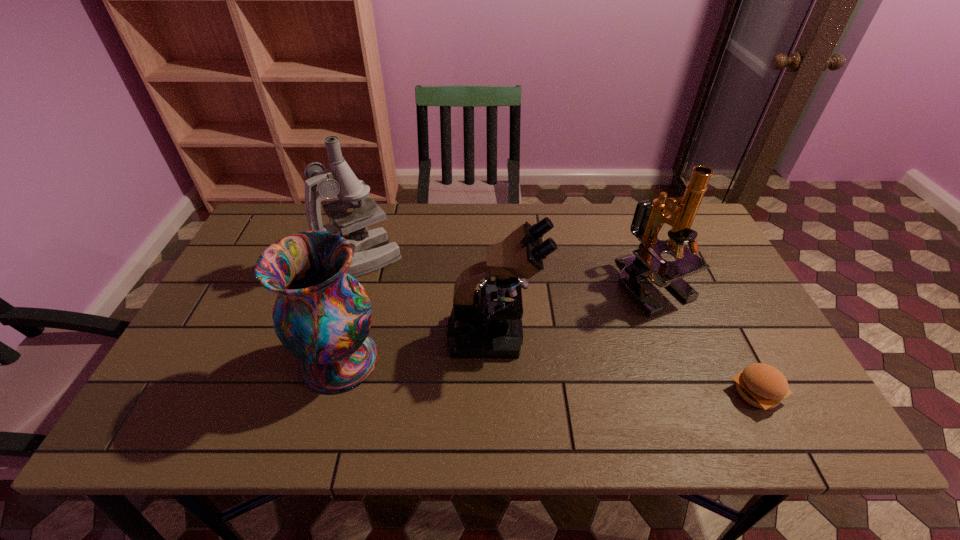
Locate an element on the screen. The width and height of the screenshot is (960, 540). object at the far edge is located at coordinates (371, 250).

In order to click on object that is positioned at the near edge in this screenshot , I will do `click(761, 385)`.

The image size is (960, 540). In order to click on microscope present at the right edge in this screenshot , I will do [x=649, y=217].

Locate an element on the screen. This screenshot has width=960, height=540. hamburger present at the right edge is located at coordinates (761, 385).

At what (x,y) coordinates should I click in order to perform the action: click on object that is at the near right corner. Please return your answer as a coordinate pair (x, y). Looking at the image, I should click on (761, 385).

Find the location of a particular element. Image resolution: width=960 pixels, height=540 pixels. vacant space at the far edge of the desktop is located at coordinates (551, 210).

This screenshot has height=540, width=960. In the image, there is a desktop. Find the location of `free space at the near edge`. free space at the near edge is located at coordinates (257, 423).

In the image, there is a desktop. Where is `vacant area at the right edge`? vacant area at the right edge is located at coordinates (743, 331).

Locate an element on the screen. The width and height of the screenshot is (960, 540). vacant space at the far left corner of the desktop is located at coordinates (257, 243).

In the image, there is a desktop. Where is `vacant space at the far right corner`? Image resolution: width=960 pixels, height=540 pixels. vacant space at the far right corner is located at coordinates (692, 230).